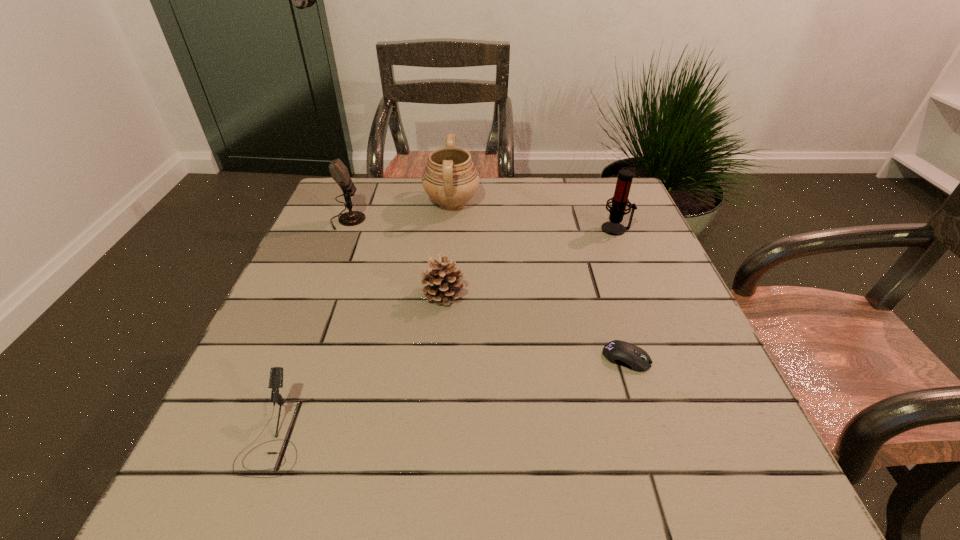
I want to click on urn, so click(x=450, y=178).

Find the location of a particular element. The height and width of the screenshot is (540, 960). the rightmost microphone is located at coordinates (620, 200).

Where is `the third nearest object`? the third nearest object is located at coordinates (443, 279).

I want to click on the shortest microphone, so click(x=276, y=373).

Identify the location of the fifth tallest object. (276, 373).

The image size is (960, 540). Find the location of `computer equipment`. computer equipment is located at coordinates (622, 353).

Where is `the second nearest object`? The image size is (960, 540). the second nearest object is located at coordinates (622, 353).

The height and width of the screenshot is (540, 960). Find the location of `free space located on the front-facing side of the urn`. free space located on the front-facing side of the urn is located at coordinates pos(564,203).

I want to click on vacant space situated 0.090m on the left of the rightmost microphone, so click(x=567, y=229).

The height and width of the screenshot is (540, 960). Find the location of `free space located on the back of the fourth farthest object`. free space located on the back of the fourth farthest object is located at coordinates (451, 214).